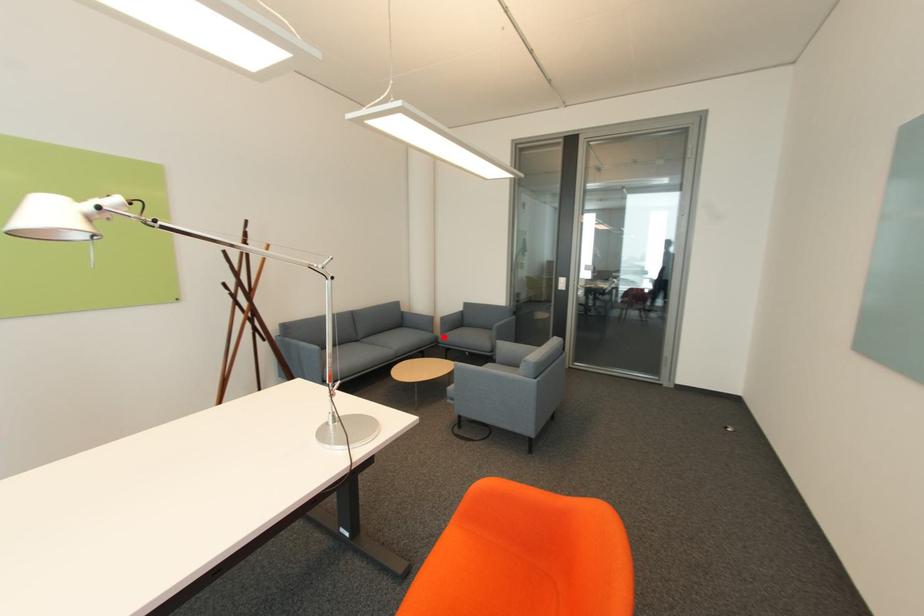
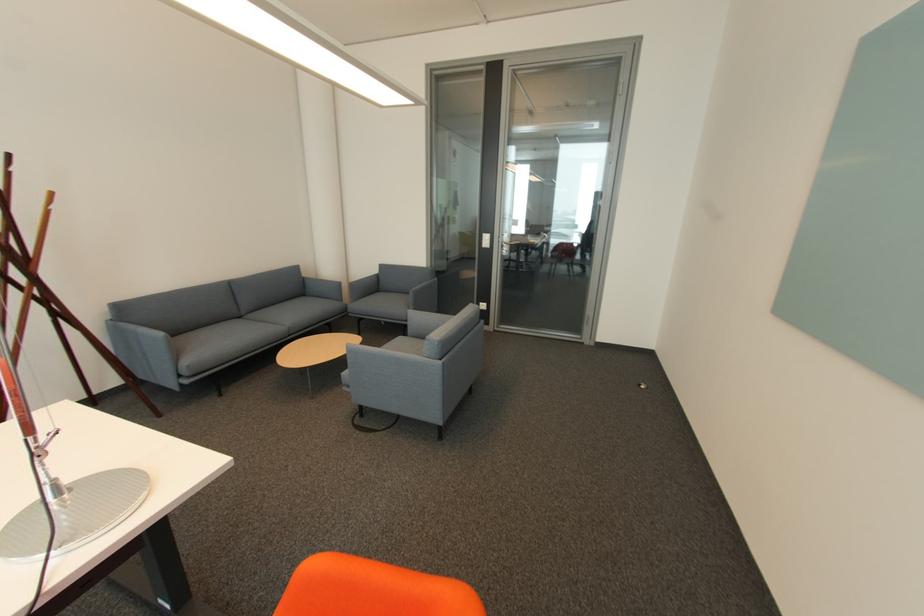
Question: I am providing you with two images of the same scene from different viewpoints. Given a red point in image1, look at the same physical point in image2. Is it:

Choices:
 (A) Closer to the viewpoint
 (B) Farther from the viewpoint

Answer: (B)